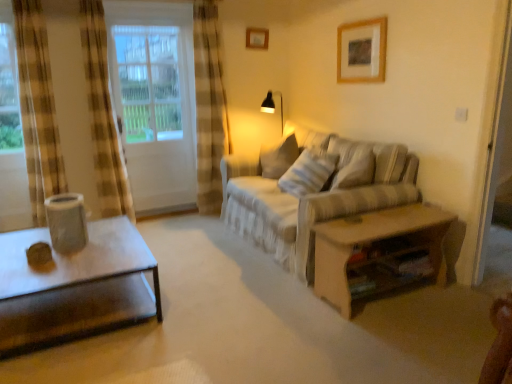
Where is `wooden picture frame at upper center, which is the first picture frame from right to left`? wooden picture frame at upper center, which is the first picture frame from right to left is located at coordinates (362, 51).

Measure the distance between white striped fabric pillow at center and camera.

The distance of white striped fabric pillow at center from camera is 3.44 meters.

Image resolution: width=512 pixels, height=384 pixels. Describe the element at coordinates (309, 172) in the screenshot. I see `white striped fabric pillow at center` at that location.

Locate an element on the screen. wooden picture frame at upper center, arranged as the first picture frame when viewed from the left is located at coordinates (257, 38).

Find the location of `wooden table at right`. wooden table at right is located at coordinates (372, 240).

What is the approximate width of matte plastic speaker at left?

The width of matte plastic speaker at left is 10.91 inches.

This screenshot has width=512, height=384. Identify the location of wooden picture frame at upper center, which is counted as the second picture frame, starting from the back. (362, 51).

Which of these two, white glass door at left or wooden picture frame at upper center, the 2th picture frame in the bottom-to-top sequence, is wider?

Wider between the two is white glass door at left.

Is wooden picture frame at upper center, marked as the 2th picture frame in a front-to-back arrangement, surrounded by white glass door at left?

That's incorrect, wooden picture frame at upper center, marked as the 2th picture frame in a front-to-back arrangement, is not inside white glass door at left.

From a real-world perspective, is white glass door at left above or below wooden picture frame at upper center, the 2th picture frame in the bottom-to-top sequence?

In terms of real-world spatial position, white glass door at left is below wooden picture frame at upper center, the 2th picture frame in the bottom-to-top sequence.

What's the angular difference between matte black table lamp at upper center and white glass door at left's facing directions?

The facing directions of matte black table lamp at upper center and white glass door at left are 32.3 degrees apart.

Could you tell me if matte black table lamp at upper center is turned towards white glass door at left?

No.

Considering the points (268, 108) and (145, 87), which point is behind, point (268, 108) or point (145, 87)?

The point (268, 108) is more distant.

From a real-world perspective, is matte black table lamp at upper center over white glass door at left?

Result: No, from a real-world perspective, matte black table lamp at upper center is not over white glass door at left

Considering the positions of objects matte black table lamp at upper center and wooden picture frame at upper center, which is counted as the second picture frame, starting from the back, in the image provided, who is more to the right, matte black table lamp at upper center or wooden picture frame at upper center, which is counted as the second picture frame, starting from the back,?

From the viewer's perspective, wooden picture frame at upper center, which is counted as the second picture frame, starting from the back, appears more on the right side.

Between point (272, 109) and point (347, 42), which one is positioned behind?

Positioned behind is point (272, 109).

Is matte black table lamp at upper center wider than wooden picture frame at upper center, the first picture frame in the front-to-back sequence?

Correct, the width of matte black table lamp at upper center exceeds that of wooden picture frame at upper center, the first picture frame in the front-to-back sequence.

Is matte black table lamp at upper center beside wooden picture frame at upper center, positioned as the 1th picture frame in bottom-to-top order?

They are not placed beside each other.

In the scene shown: Which of these two, wooden picture frame at upper center, the second picture frame from the left, or wooden picture frame at upper center, arranged as the first picture frame when viewed from the left, is wider?

wooden picture frame at upper center, arranged as the first picture frame when viewed from the left, is wider.

Are wooden picture frame at upper center, the first picture frame in the front-to-back sequence, and wooden picture frame at upper center, arranged as the first picture frame when viewed from the left, far apart?

Yes, wooden picture frame at upper center, the first picture frame in the front-to-back sequence, and wooden picture frame at upper center, arranged as the first picture frame when viewed from the left, are located far from each other.

Considering the sizes of wooden picture frame at upper center, which is the first picture frame from right to left, and wooden picture frame at upper center, marked as the 2th picture frame in a right-to-left arrangement, in the image, is wooden picture frame at upper center, which is the first picture frame from right to left, taller or shorter than wooden picture frame at upper center, marked as the 2th picture frame in a right-to-left arrangement,?

Considering their sizes, wooden picture frame at upper center, which is the first picture frame from right to left, has more height than wooden picture frame at upper center, marked as the 2th picture frame in a right-to-left arrangement.

Is there a large distance between wooden picture frame at upper center, positioned as the 1th picture frame in bottom-to-top order, and matte plastic speaker at left?

Yes, wooden picture frame at upper center, positioned as the 1th picture frame in bottom-to-top order, and matte plastic speaker at left are located far from each other.

Consider the image. Is wooden picture frame at upper center, the second picture frame from the left, outside of matte plastic speaker at left?

wooden picture frame at upper center, the second picture frame from the left, lies outside matte plastic speaker at left's area.

From the image's perspective, is wooden picture frame at upper center, positioned as the 2th picture frame in top-to-bottom order, positioned above or below matte plastic speaker at left?

From the image's perspective, wooden picture frame at upper center, positioned as the 2th picture frame in top-to-bottom order, appears above matte plastic speaker at left.

Where is `gray that appears in front of the wooden picture frame at upper center, positioned as the 1th picture frame in bottom-to-top order`? gray that appears in front of the wooden picture frame at upper center, positioned as the 1th picture frame in bottom-to-top order is located at coordinates pos(67,222).

Is wooden picture frame at upper center, marked as the 2th picture frame in a front-to-back arrangement, looking in the opposite direction of wooden picture frame at upper center, which is the first picture frame from right to left?

No.

Is wooden picture frame at upper center, marked as the 2th picture frame in a front-to-back arrangement, wider than wooden picture frame at upper center, which is counted as the second picture frame, starting from the back?

Yes.

Is wooden picture frame at upper center, marked as the 2th picture frame in a front-to-back arrangement, far away from wooden picture frame at upper center, which is counted as the second picture frame, starting from the back?

Yes, wooden picture frame at upper center, marked as the 2th picture frame in a front-to-back arrangement, is far from wooden picture frame at upper center, which is counted as the second picture frame, starting from the back.

Is wooden picture frame at upper center, acting as the first picture frame starting from the back, to the right of wooden picture frame at upper center, the first picture frame in the front-to-back sequence, from the viewer's perspective?

No, wooden picture frame at upper center, acting as the first picture frame starting from the back, is not to the right of wooden picture frame at upper center, the first picture frame in the front-to-back sequence.

In the image, is wooden table at right on the left side or the right side of wooden picture frame at upper center, the second picture frame from the left?

In the image, wooden table at right appears on the left side of wooden picture frame at upper center, the second picture frame from the left.

Between wooden table at right and wooden picture frame at upper center, the first picture frame in the front-to-back sequence, which one has less height?

wooden picture frame at upper center, the first picture frame in the front-to-back sequence.

In the image, is wooden table at right positioned in front of or behind wooden picture frame at upper center, positioned as the 1th picture frame in bottom-to-top order?

wooden table at right is in front of wooden picture frame at upper center, positioned as the 1th picture frame in bottom-to-top order.

Identify the location of window below the wooden picture frame at upper center, which ranks as the 1th picture frame in top-to-bottom order (from the image's perspective). Image resolution: width=512 pixels, height=384 pixels. coord(154,101).

The width and height of the screenshot is (512, 384). I want to click on window that is on the left side of matte black table lamp at upper center, so click(154, 101).

When comparing their distances from wooden picture frame at upper center, which is the first picture frame from right to left, does matte black table lamp at upper center or matte plastic speaker at left seem further?

matte plastic speaker at left is further to wooden picture frame at upper center, which is the first picture frame from right to left.

Estimate the real-world distances between objects in this image. Which object is further from beige fabric couch at center, matte plastic speaker at left or white striped fabric pillow at center?

matte plastic speaker at left is further to beige fabric couch at center.

Considering their positions, is wooden picture frame at upper center, which ranks as the 1th picture frame in top-to-bottom order, positioned closer to wooden picture frame at upper center, the first picture frame in the front-to-back sequence, than white glass door at left?

The object closer to wooden picture frame at upper center, the first picture frame in the front-to-back sequence, is wooden picture frame at upper center, which ranks as the 1th picture frame in top-to-bottom order.

Which object lies further to the anchor point white glass door at left, wooden picture frame at upper center, arranged as the first picture frame when viewed from the left, or beige fabric couch at center?

The object further to white glass door at left is beige fabric couch at center.

Considering their positions, is wooden picture frame at upper center, which is counted as the second picture frame, starting from the back, positioned closer to white striped fabric pillow at center than wooden picture frame at upper center, marked as the 2th picture frame in a front-to-back arrangement?

wooden picture frame at upper center, which is counted as the second picture frame, starting from the back.

Which object lies further to the anchor point matte plastic speaker at left, beige fabric couch at center or wooden table at right?

wooden table at right lies further to matte plastic speaker at left than the other object.

From the image, which object appears to be farther from wooden picture frame at upper center, which ranks as the 1th picture frame in top-to-bottom order, white striped fabric pillow at center or wooden picture frame at upper center, the first picture frame in the front-to-back sequence?

white striped fabric pillow at center.

Which object lies further to the anchor point wooden picture frame at upper center, positioned as the 1th picture frame in bottom-to-top order, wooden table at right or matte plastic speaker at left?

The object further to wooden picture frame at upper center, positioned as the 1th picture frame in bottom-to-top order, is matte plastic speaker at left.

Where is `pillow between beige fabric couch at center and matte black table lamp at upper center from front to back`? pillow between beige fabric couch at center and matte black table lamp at upper center from front to back is located at coordinates (309, 172).

Image resolution: width=512 pixels, height=384 pixels. In order to click on studio couch between white glass door at left and wooden table at right in the horizontal direction in this screenshot , I will do `click(313, 192)`.

Find the location of a particular element. picture frame located between white glass door at left and wooden picture frame at upper center, positioned as the 1th picture frame in bottom-to-top order, in the left-right direction is located at coordinates (257, 38).

Locate an element on the screen. Image resolution: width=512 pixels, height=384 pixels. picture frame between white glass door at left and white striped fabric pillow at center is located at coordinates (257, 38).